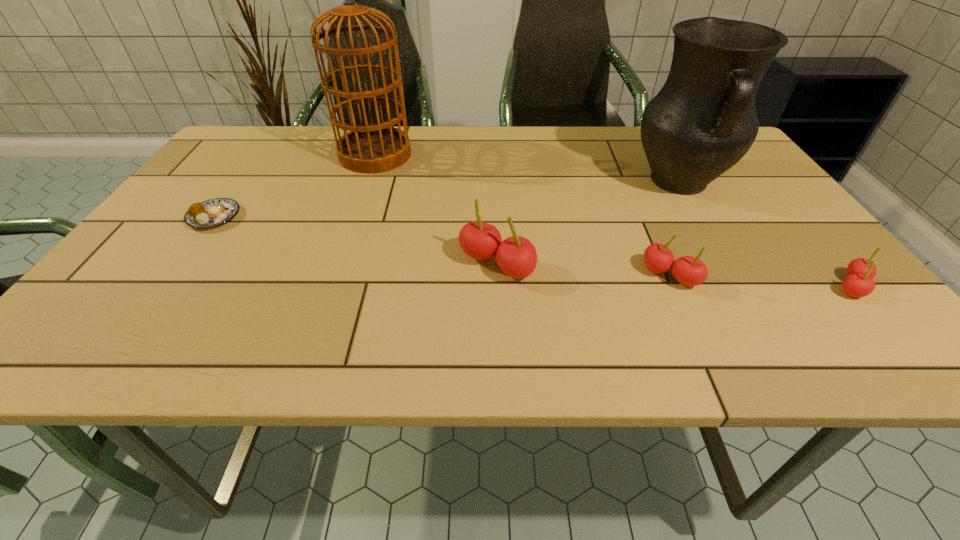
I want to click on the tallest cherry, so click(x=516, y=256).

Locate an element on the screen. The image size is (960, 540). the leftmost cherry is located at coordinates (516, 256).

The height and width of the screenshot is (540, 960). I want to click on the second cherry from right to left, so click(690, 271).

Locate an element on the screen. the fourth tallest object is located at coordinates (690, 271).

You are a GUI agent. You are given a task and a screenshot of the screen. Output one action in this format:
    pyautogui.click(x=<x>, y=<y>)
    Task: Click on the rightmost object
    The height and width of the screenshot is (540, 960).
    Given the screenshot: What is the action you would take?
    pyautogui.click(x=859, y=283)

Locate an element on the screen. The height and width of the screenshot is (540, 960). the shortest cherry is located at coordinates (859, 283).

You are a GUI agent. You are given a task and a screenshot of the screen. Output one action in this format:
    pyautogui.click(x=<x>, y=<y>)
    Task: Click on the tallest object
    
    Given the screenshot: What is the action you would take?
    pyautogui.click(x=377, y=148)

I want to click on birdcage, so click(377, 148).

At what (x,y) coordinates should I click in order to perform the action: click on the second tallest object. Please return your answer as a coordinate pair (x, y). Looking at the image, I should click on (702, 122).

Where is `the shortest object`? The image size is (960, 540). the shortest object is located at coordinates (210, 213).